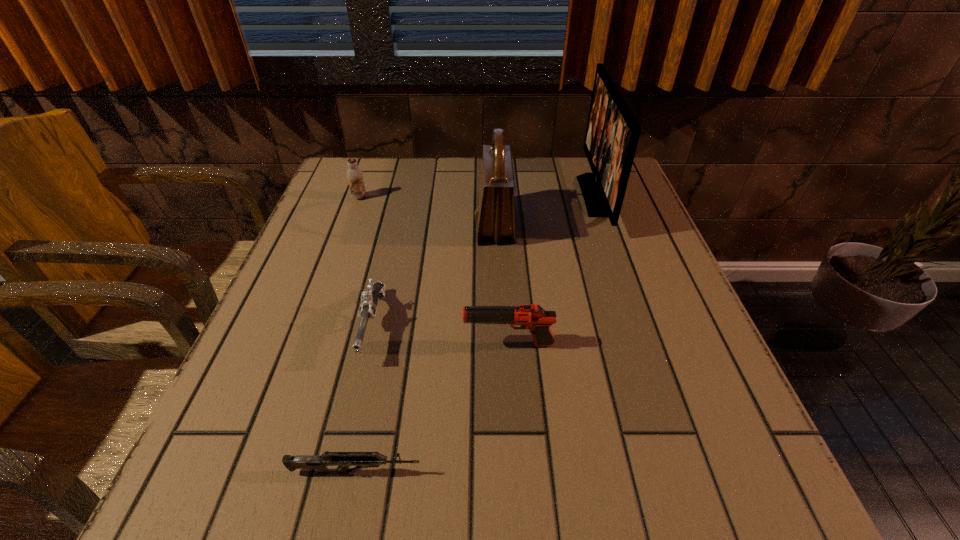
This screenshot has width=960, height=540. I want to click on the rightmost object, so click(x=612, y=133).

Where is `shoulder bag`? shoulder bag is located at coordinates (495, 216).

Where is `the leftmost object`? Image resolution: width=960 pixels, height=540 pixels. the leftmost object is located at coordinates (354, 175).

This screenshot has width=960, height=540. What are the coordinates of `the tallest gun` in the screenshot? It's located at (533, 317).

At what (x,y) coordinates should I click in order to perform the action: click on the fifth tallest object. Please return your answer as a coordinate pair (x, y). Image resolution: width=960 pixels, height=540 pixels. Looking at the image, I should click on (369, 299).

I want to click on the nearest object, so click(x=319, y=463).

This screenshot has height=540, width=960. What are the coordinates of `the shortest object` in the screenshot? It's located at (319, 463).

You are a GUI agent. You are given a task and a screenshot of the screen. Output one action in this format:
    pyautogui.click(x=<x>, y=<y>)
    Task: Click on the free space located on the front-facing side of the rightmost object
    
    Given the screenshot: What is the action you would take?
    pyautogui.click(x=544, y=196)

Locate an element on the screen. Image resolution: width=960 pixels, height=540 pixels. free region located on the front-facing side of the rightmost object is located at coordinates (458, 196).

Locate an element on the screen. This screenshot has height=540, width=960. vacant space situated 0.120m on the front-facing side of the rightmost object is located at coordinates (537, 196).